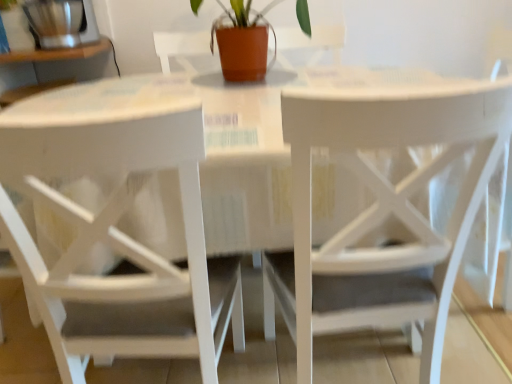
Image resolution: width=512 pixels, height=384 pixels. Identify the location of white wood chair at center, which appears as the second chair when viewed from the right. (119, 243).

What are the coordinates of `terracotta clay pot at center` in the screenshot? It's located at (242, 42).

Describe the element at coordinates (242, 42) in the screenshot. This screenshot has height=384, width=512. I see `terracotta clay pot at center` at that location.

Find the location of a particular element. The image size is (512, 384). white wood chair at center, which appears as the second chair when viewed from the right is located at coordinates (119, 243).

In terms of height, does brushed metal coffee grinder at upper left look taller or shorter compared to terracotta clay pot at center?

In the image, brushed metal coffee grinder at upper left appears to be shorter than terracotta clay pot at center.

From a real-world perspective, is brushed metal coffee grinder at upper left under terracotta clay pot at center?

No, from a real-world perspective, brushed metal coffee grinder at upper left is not under terracotta clay pot at center.

Where is `appliance that is on the left side of terracotta clay pot at center`? This screenshot has width=512, height=384. appliance that is on the left side of terracotta clay pot at center is located at coordinates (62, 22).

Does brushed metal coffee grinder at upper left have a greater width compared to terracotta clay pot at center?

In fact, brushed metal coffee grinder at upper left might be narrower than terracotta clay pot at center.

Looking at this image, from the image's perspective, which one is positioned lower, white wood chair at center, which appears as the second chair when viewed from the right, or terracotta clay pot at center?

white wood chair at center, which appears as the second chair when viewed from the right, appears lower in the image.

Does point (69, 163) lie in front of point (240, 42)?

Yes, point (69, 163) is closer to viewer.

Do you think white wood chair at center, which appears as the second chair when viewed from the right, is within terracotta clay pot at center, or outside of it?

white wood chair at center, which appears as the second chair when viewed from the right, is spatially situated outside terracotta clay pot at center.

Looking at this image, looking at their sizes, would you say white wood chair at center, which appears as the second chair when viewed from the right, is wider or thinner than terracotta clay pot at center?

Clearly, white wood chair at center, which appears as the second chair when viewed from the right, has less width compared to terracotta clay pot at center.

Who is smaller, white wood chair at center, which ranks as the first chair in left-to-right order, or white matte chair at center, arranged as the first chair when viewed from the right?

With smaller size is white wood chair at center, which ranks as the first chair in left-to-right order.

Does white wood chair at center, which ranks as the first chair in left-to-right order, have a lesser height compared to white matte chair at center, the second chair positioned from the left?

Correct, white wood chair at center, which ranks as the first chair in left-to-right order, is not as tall as white matte chair at center, the second chair positioned from the left.

Is white wood chair at center, which appears as the second chair when viewed from the right, aimed at white matte chair at center, arranged as the first chair when viewed from the right?

No, white wood chair at center, which appears as the second chair when viewed from the right, does not turn towards white matte chair at center, arranged as the first chair when viewed from the right.

Is white wood chair at center, which ranks as the first chair in left-to-right order, to the right of white matte chair at center, arranged as the first chair when viewed from the right, from the viewer's perspective?

No, white wood chair at center, which ranks as the first chair in left-to-right order, is not to the right of white matte chair at center, arranged as the first chair when viewed from the right.

In the scene shown: Can you see terracotta clay pot at center touching white wood chair at center, which ranks as the first chair in left-to-right order?

They are not placed beside each other.

Which is closer, (x=224, y=52) or (x=150, y=115)?

The point (x=150, y=115) is closer to the camera.

Considering the relative sizes of terracotta clay pot at center and white wood chair at center, which appears as the second chair when viewed from the right, in the image provided, is terracotta clay pot at center thinner than white wood chair at center, which appears as the second chair when viewed from the right,?

Incorrect, the width of terracotta clay pot at center is not less than that of white wood chair at center, which appears as the second chair when viewed from the right.

Who is shorter, terracotta clay pot at center or white wood chair at center, which appears as the second chair when viewed from the right?

terracotta clay pot at center.

Is terracotta clay pot at center looking in the opposite direction of brushed metal coffee grinder at upper left?

No, terracotta clay pot at center is not facing the opposite direction of brushed metal coffee grinder at upper left.

Based on their sizes in the image, would you say terracotta clay pot at center is bigger or smaller than brushed metal coffee grinder at upper left?

Considering their sizes, terracotta clay pot at center takes up more space than brushed metal coffee grinder at upper left.

Are terracotta clay pot at center and brushed metal coffee grinder at upper left far apart?

Actually, terracotta clay pot at center and brushed metal coffee grinder at upper left are a little close together.

How many degrees apart are the facing directions of white wood chair at center, which appears as the second chair when viewed from the right, and brushed metal coffee grinder at upper left?

white wood chair at center, which appears as the second chair when viewed from the right, and brushed metal coffee grinder at upper left are facing 179 degrees away from each other.

At what (x,y) coordinates should I click in order to perform the action: click on the 1st chair located beneath the brushed metal coffee grinder at upper left (from a real-world perspective). Please return your answer as a coordinate pair (x, y). Looking at the image, I should click on (119, 243).

Which of these two, white wood chair at center, which appears as the second chair when viewed from the right, or brushed metal coffee grinder at upper left, is bigger?

Bigger between the two is white wood chair at center, which appears as the second chair when viewed from the right.

From a real-world perspective, is white wood chair at center, which ranks as the first chair in left-to-right order, positioned under brushed metal coffee grinder at upper left based on gravity?

Yes, from a real-world perspective, white wood chair at center, which ranks as the first chair in left-to-right order, is beneath brushed metal coffee grinder at upper left.

From the image's perspective, is brushed metal coffee grinder at upper left above or below white wood chair at center, which appears as the second chair when viewed from the right?

Based on their image positions, brushed metal coffee grinder at upper left is located above white wood chair at center, which appears as the second chair when viewed from the right.

Is brushed metal coffee grinder at upper left looking in the opposite direction of white wood chair at center, which ranks as the first chair in left-to-right order?

brushed metal coffee grinder at upper left does not have its back to white wood chair at center, which ranks as the first chair in left-to-right order.

Is brushed metal coffee grinder at upper left behind white wood chair at center, which appears as the second chair when viewed from the right?

Yes, brushed metal coffee grinder at upper left is behind white wood chair at center, which appears as the second chair when viewed from the right.

From a real-world perspective, which chair is the 1st one underneath the brushed metal coffee grinder at upper left? Please provide its 2D coordinates.

[(119, 243)]

Locate an element on the screen. The image size is (512, 384). appliance behind the terracotta clay pot at center is located at coordinates (62, 22).

At what (x,y) coordinates should I click in order to perform the action: click on houseplant above the white wood chair at center, which appears as the second chair when viewed from the right (from the image's perspective). Please return your answer as a coordinate pair (x, y). Image resolution: width=512 pixels, height=384 pixels. Looking at the image, I should click on (242, 42).

Looking at the image, which one is located further to white matte chair at center, arranged as the first chair when viewed from the right, terracotta clay pot at center or brushed metal coffee grinder at upper left?

brushed metal coffee grinder at upper left lies further to white matte chair at center, arranged as the first chair when viewed from the right, than the other object.

Estimate the real-world distances between objects in this image. Which object is further from brushed metal coffee grinder at upper left, white wood chair at center, which ranks as the first chair in left-to-right order, or terracotta clay pot at center?

Based on the image, white wood chair at center, which ranks as the first chair in left-to-right order, appears to be further to brushed metal coffee grinder at upper left.

Consider the image. Estimate the real-world distances between objects in this image. Which object is closer to white matte chair at center, arranged as the first chair when viewed from the right, white wood chair at center, which ranks as the first chair in left-to-right order, or brushed metal coffee grinder at upper left?

The object closer to white matte chair at center, arranged as the first chair when viewed from the right, is white wood chair at center, which ranks as the first chair in left-to-right order.

When comparing their distances from white wood chair at center, which ranks as the first chair in left-to-right order, does white matte chair at center, the second chair positioned from the left, or brushed metal coffee grinder at upper left seem closer?

Based on the image, white matte chair at center, the second chair positioned from the left, appears to be nearer to white wood chair at center, which ranks as the first chair in left-to-right order.

Considering their positions, is white wood chair at center, which appears as the second chair when viewed from the right, positioned further to terracotta clay pot at center than brushed metal coffee grinder at upper left?

white wood chair at center, which appears as the second chair when viewed from the right.

Which object lies further to the anchor point brushed metal coffee grinder at upper left, terracotta clay pot at center or white matte chair at center, arranged as the first chair when viewed from the right?

The object further to brushed metal coffee grinder at upper left is white matte chair at center, arranged as the first chair when viewed from the right.

Considering their positions, is brushed metal coffee grinder at upper left positioned further to white wood chair at center, which appears as the second chair when viewed from the right, than terracotta clay pot at center?

brushed metal coffee grinder at upper left lies further to white wood chair at center, which appears as the second chair when viewed from the right, than the other object.

When comparing their distances from white matte chair at center, arranged as the first chair when viewed from the right, does brushed metal coffee grinder at upper left or terracotta clay pot at center seem further?

Based on the image, brushed metal coffee grinder at upper left appears to be further to white matte chair at center, arranged as the first chair when viewed from the right.

This screenshot has height=384, width=512. Find the location of `houseplant located between white wood chair at center, which appears as the second chair when viewed from the right, and brushed metal coffee grinder at upper left in the depth direction`. houseplant located between white wood chair at center, which appears as the second chair when viewed from the right, and brushed metal coffee grinder at upper left in the depth direction is located at coordinates (242, 42).

You are a GUI agent. You are given a task and a screenshot of the screen. Output one action in this format:
    pyautogui.click(x=<x>, y=<y>)
    Task: Click on the chair that lies between terracotta clay pot at center and white wood chair at center, which ranks as the first chair in left-to-right order, from top to bottom
    This screenshot has height=384, width=512.
    Given the screenshot: What is the action you would take?
    pyautogui.click(x=382, y=211)

At what (x,y) coordinates should I click in order to perform the action: click on houseplant between brushed metal coffee grinder at upper left and white matte chair at center, arranged as the first chair when viewed from the right, from left to right. Please return your answer as a coordinate pair (x, y). This screenshot has width=512, height=384. Looking at the image, I should click on coord(242,42).

Where is `chair positioned between white wood chair at center, which appears as the second chair when viewed from the right, and brushed metal coffee grinder at upper left from near to far`? The height and width of the screenshot is (384, 512). chair positioned between white wood chair at center, which appears as the second chair when viewed from the right, and brushed metal coffee grinder at upper left from near to far is located at coordinates (382, 211).